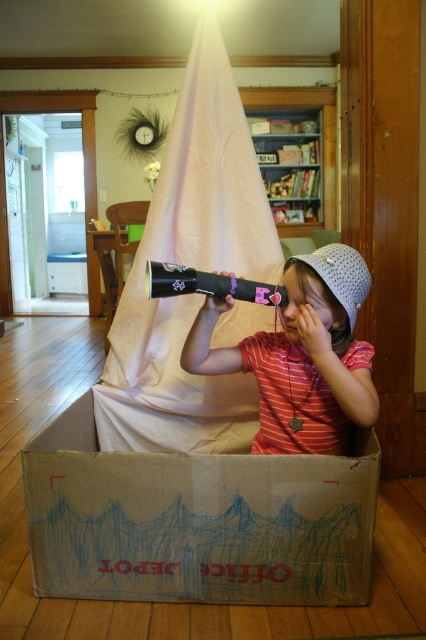
Question: Is brown cardboard box at lower center bigger than matte black telescope at center?

Choices:
 (A) no
 (B) yes

Answer: (B)

Question: Which point is farther from the camera taking this photo?

Choices:
 (A) (83, 419)
 (B) (360, 412)

Answer: (A)

Question: Can you confirm if brown cardboard box at lower center is bigger than matte black telescope at center?

Choices:
 (A) yes
 (B) no

Answer: (A)

Question: Can you confirm if brown cardboard box at lower center is wider than matte black telescope at center?

Choices:
 (A) no
 (B) yes

Answer: (B)